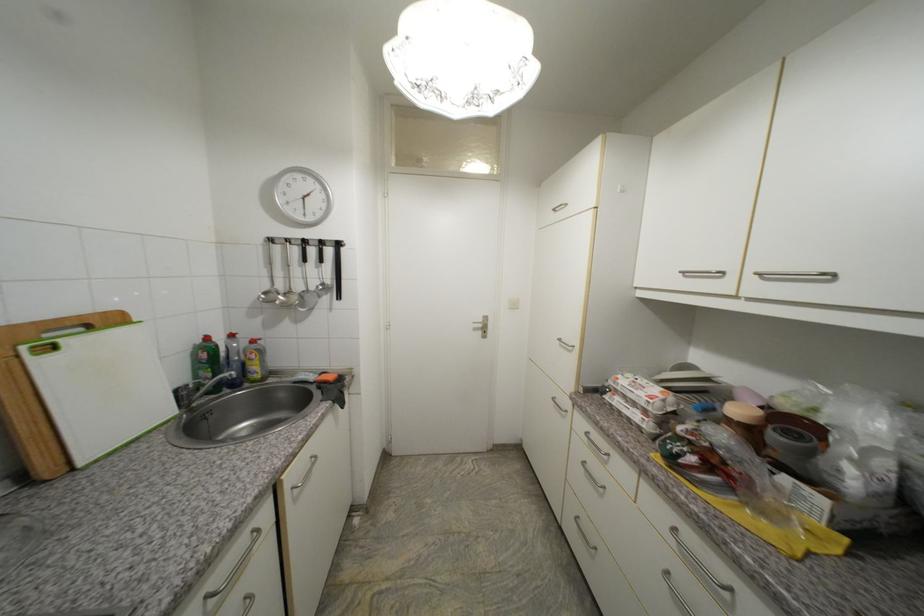
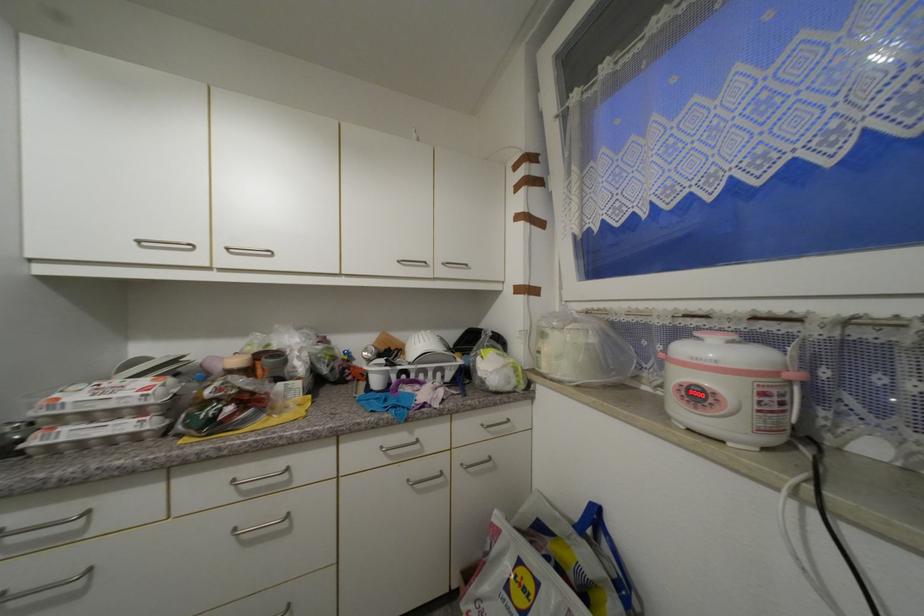
Where in the second image is the point corresponding to [623,379] from the first image?

(64, 400)